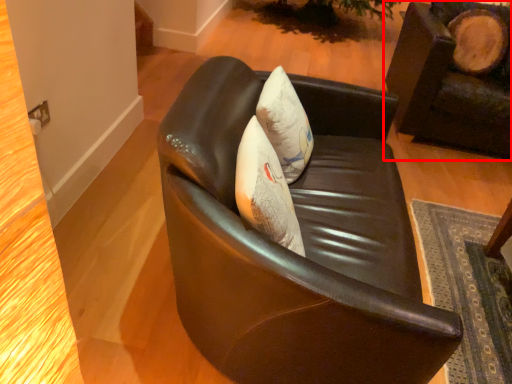
Question: From the image's perspective, what is the correct spatial relationship of chair (annotated by the red box) in relation to chair?

Choices:
 (A) above
 (B) below

Answer: (A)